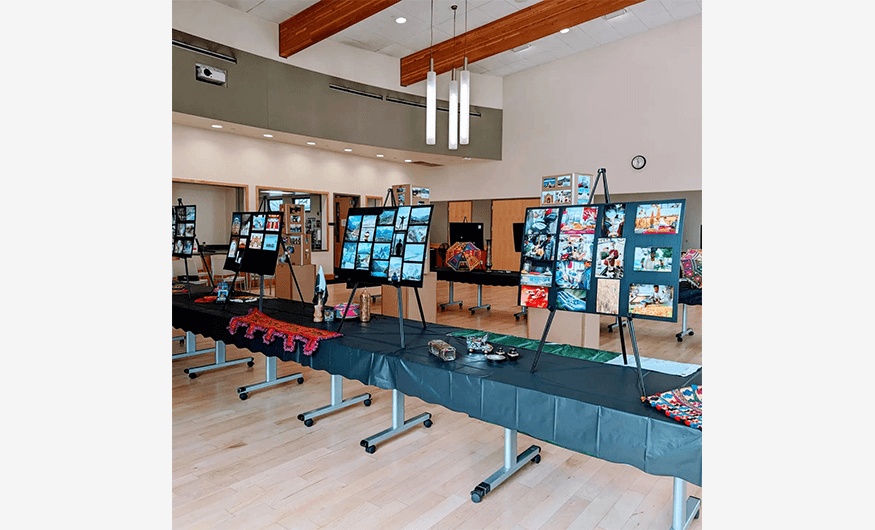
What are the coordinates of `floor` in the screenshot? It's located at (402, 488).